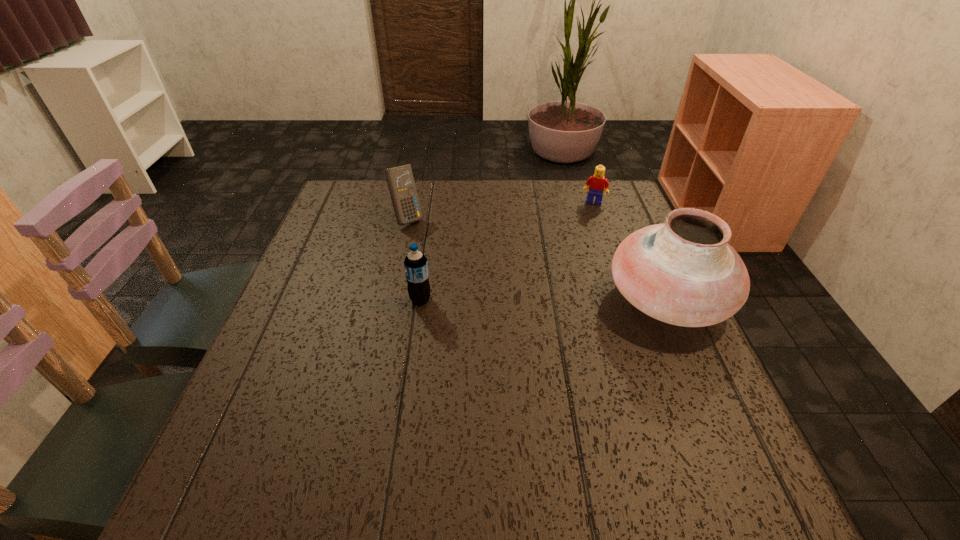
Image resolution: width=960 pixels, height=540 pixels. Find the location of `free space on the desktop that is between the soda bottle and the tallest object and is positioned on the face of the shortest object`. free space on the desktop that is between the soda bottle and the tallest object and is positioned on the face of the shortest object is located at coordinates (572, 300).

Where is `free spot on the desktop that is between the soda bottle and the pottery and is positioned on the front-facing side of the calculator`? The width and height of the screenshot is (960, 540). free spot on the desktop that is between the soda bottle and the pottery and is positioned on the front-facing side of the calculator is located at coordinates (510, 300).